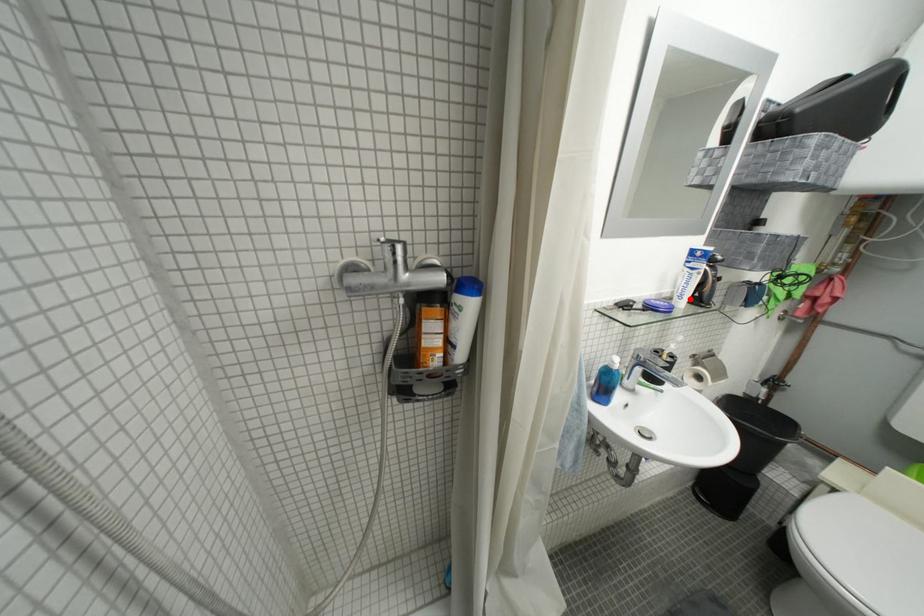
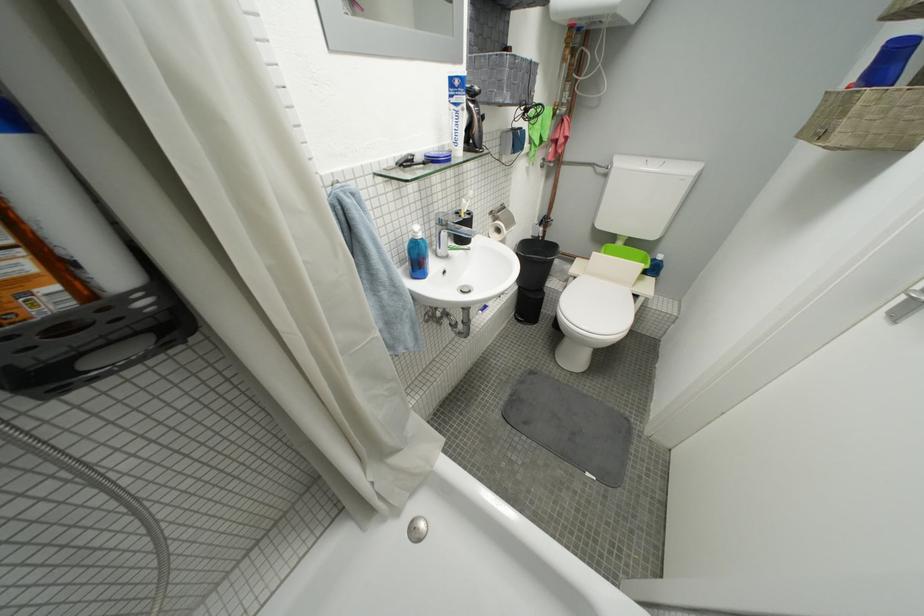
In the second image, find the point that corresponds to the highlighted location in the first image.

(465, 145)